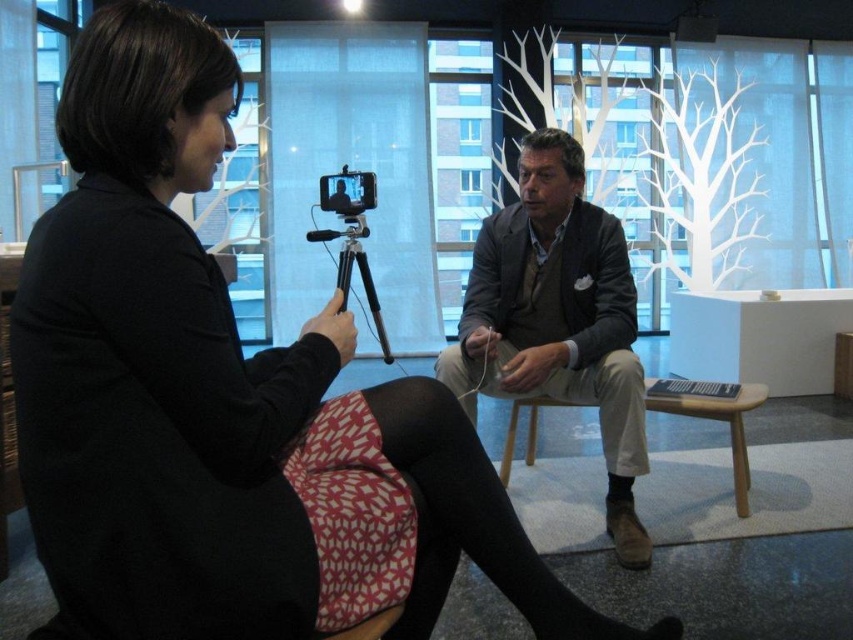
Who is positioned more to the left, black plastic tripod at center or matte black tripod-mounted camera at center?

Positioned to the left is matte black tripod-mounted camera at center.

Where is `black plastic tripod at center`? black plastic tripod at center is located at coordinates (352, 266).

Between dark brown leather jacket at center and black plastic tripod at center, which one appears on the left side from the viewer's perspective?

black plastic tripod at center

Between point (521, 364) and point (350, 252), which one is positioned behind?

The point (350, 252) is more distant.

You are a GUI agent. You are given a task and a screenshot of the screen. Output one action in this format:
    pyautogui.click(x=<x>, y=<y>)
    Task: Click on the dark brown leather jacket at center
    The image size is (853, 640).
    Given the screenshot: What is the action you would take?
    pyautogui.click(x=558, y=317)

Can you confirm if dark brown leather jacket at center is positioned below matte black tripod-mounted camera at center?

Yes, dark brown leather jacket at center is below matte black tripod-mounted camera at center.

Is dark brown leather jacket at center closer to the viewer compared to matte black tripod-mounted camera at center?

Yes, it is in front of matte black tripod-mounted camera at center.

Between point (625, 401) and point (329, 186), which one is positioned behind?

The point (329, 186) is behind.

At what (x,y) coordinates should I click in order to perform the action: click on dark brown leather jacket at center. Please return your answer as a coordinate pair (x, y). The width and height of the screenshot is (853, 640). Looking at the image, I should click on (558, 317).